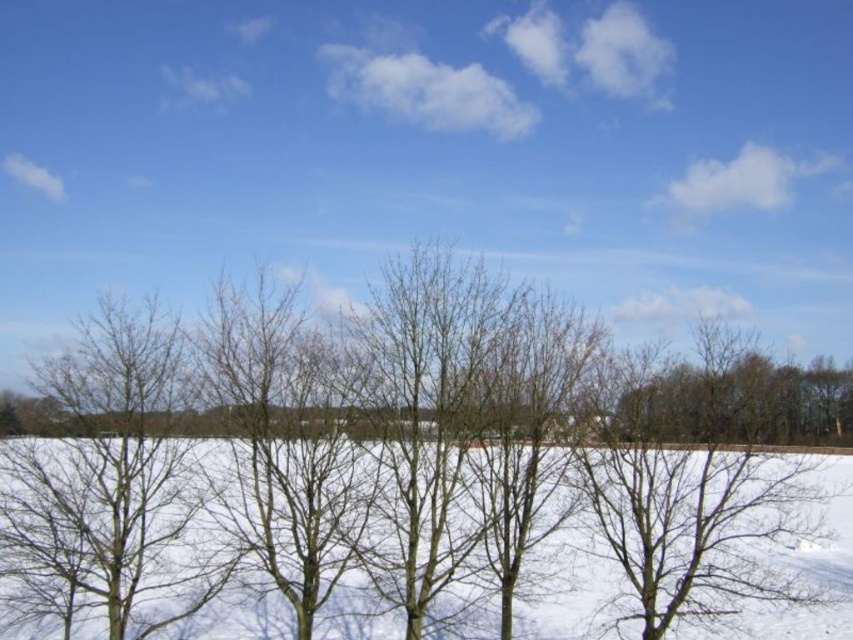
Question: Is bare branches at left above white powdery snow at center?

Choices:
 (A) no
 (B) yes

Answer: (B)

Question: Which object is farther from the camera taking this photo?

Choices:
 (A) bare branches at left
 (B) white powdery snow at center

Answer: (A)

Question: Can you confirm if bare branches at left is wider than white powdery snow at center?

Choices:
 (A) no
 (B) yes

Answer: (A)

Question: Among these points, which one is nearest to the camera?

Choices:
 (A) (119, 604)
 (B) (848, 628)

Answer: (A)

Question: Can you confirm if bare branches at left is positioned to the left of white powdery snow at center?

Choices:
 (A) yes
 (B) no

Answer: (A)